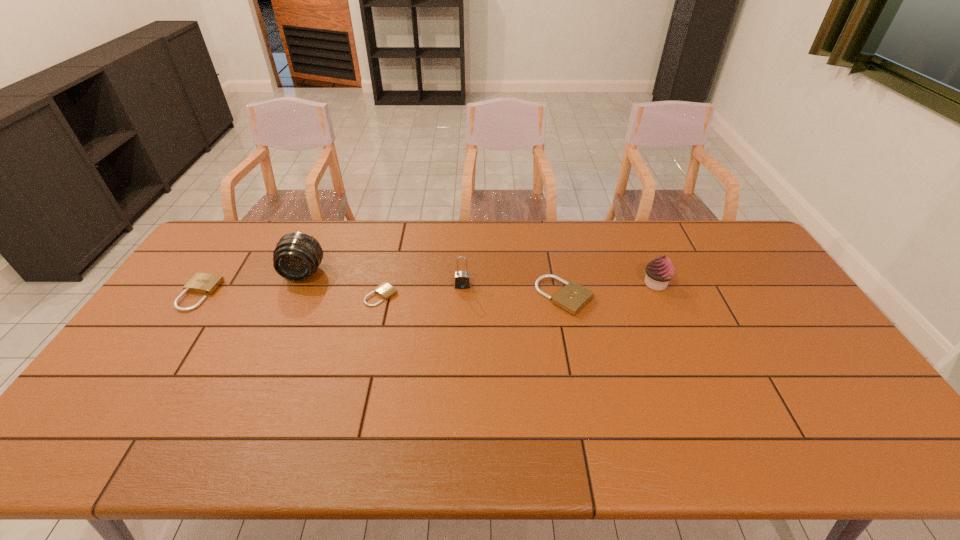
Locate an element on the screen. The height and width of the screenshot is (540, 960). blank space located on the right of the leftmost padlock is located at coordinates (252, 294).

The image size is (960, 540). Identify the location of vacant position located 0.090m on the front of the shortest padlock. (373, 329).

Locate an element on the screen. Image resolution: width=960 pixels, height=540 pixels. vacant space located 0.170m on the front of the second object from right to left is located at coordinates (578, 363).

The width and height of the screenshot is (960, 540). What are the coordinates of `free space located at the front element of the telephoto lens` in the screenshot? It's located at (283, 319).

The image size is (960, 540). In order to click on free point located 0.120m on the left of the rightmost object in this screenshot , I will do `click(605, 284)`.

Where is `vacant area situated on the shackle of the tallest padlock`? vacant area situated on the shackle of the tallest padlock is located at coordinates 462,315.

The width and height of the screenshot is (960, 540). What are the coordinates of `object located at the left edge` in the screenshot? It's located at (201, 283).

Find the location of a particular element. free spot at the far edge of the desktop is located at coordinates (590, 239).

The width and height of the screenshot is (960, 540). In the image, there is a desktop. In order to click on vacant space at the near edge in this screenshot , I will do `click(186, 388)`.

The width and height of the screenshot is (960, 540). I want to click on free location at the left edge of the desktop, so click(217, 300).